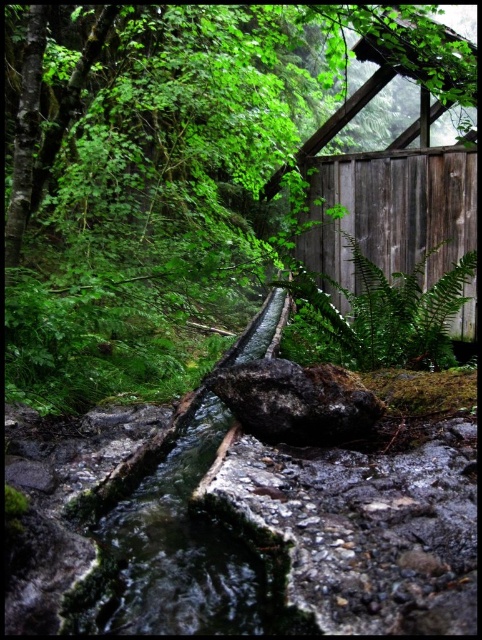
Question: Can you confirm if wooden hut at upper right is positioned to the right of rough textured rock at center?

Choices:
 (A) yes
 (B) no

Answer: (A)

Question: Which is nearer to the green leafy tree at center?

Choices:
 (A) green leafy fern at center
 (B) wooden hut at upper right

Answer: (A)

Question: Which object appears farthest from the camera in this image?

Choices:
 (A) green leafy tree at center
 (B) rough textured rock at center
 (C) wooden hut at upper right
 (D) green leafy fern at center

Answer: (C)

Question: Is green leafy tree at center thinner than rough textured rock at center?

Choices:
 (A) no
 (B) yes

Answer: (B)

Question: Does green leafy tree at center have a smaller size compared to rough textured rock at center?

Choices:
 (A) no
 (B) yes

Answer: (A)

Question: Considering the real-world distances, which object is farthest from the green leafy tree at center?

Choices:
 (A) green leafy fern at center
 (B) rough textured rock at center
 (C) wooden hut at upper right

Answer: (B)